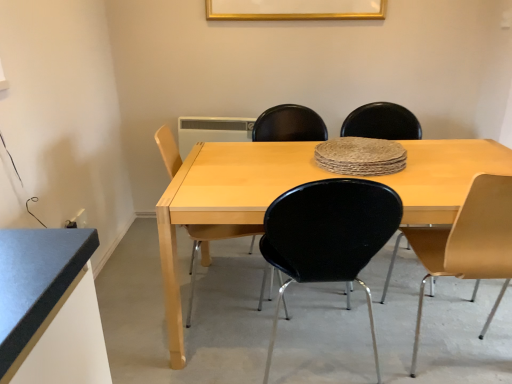
At what (x,y) coordinates should I click in order to perform the action: click on vacant space positioned to the left of light wood/black plastic chair at center, the 1th chair when ordered from left to right. Please return your answer as a coordinate pair (x, y). The width and height of the screenshot is (512, 384). Looking at the image, I should click on (137, 304).